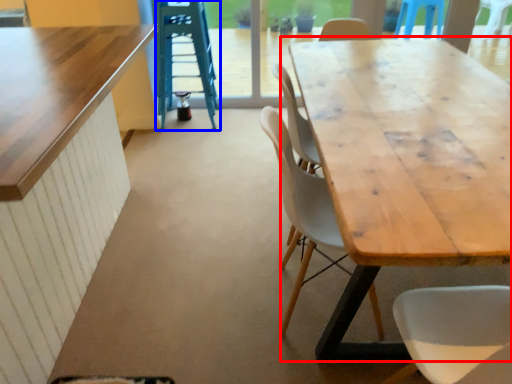
Question: Which point is further to the camera, table (highlighted by a red box) or ladder (highlighted by a blue box)?

Choices:
 (A) table
 (B) ladder

Answer: (B)